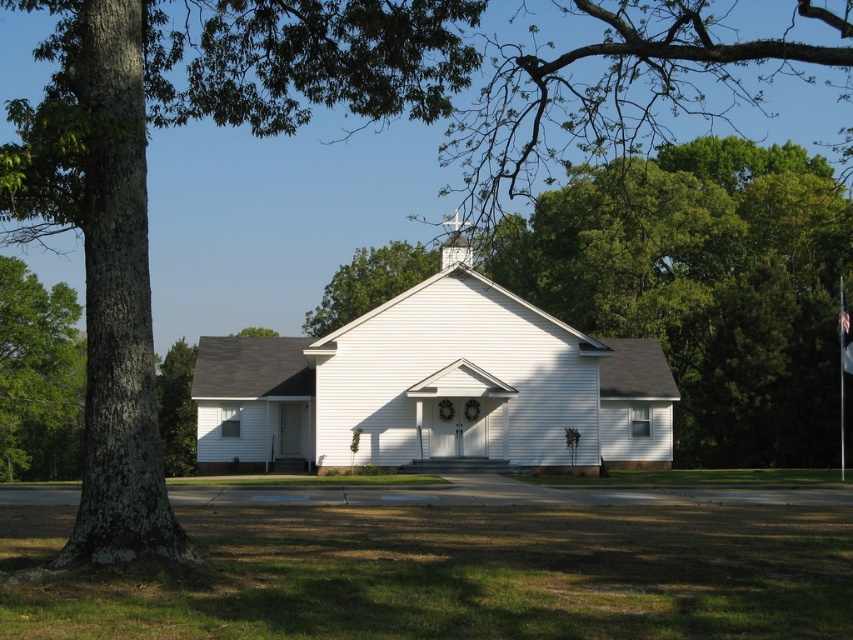
Question: Does green leafy tree at left have a lesser width compared to white wood spire at upper center?

Choices:
 (A) yes
 (B) no

Answer: (B)

Question: Is white wood church at center closer to the viewer compared to white wood spire at upper center?

Choices:
 (A) no
 (B) yes

Answer: (B)

Question: Which object appears closest to the camera in this image?

Choices:
 (A) green leafy tree at center
 (B) white wood spire at upper center
 (C) green leafy tree at left
 (D) green rough bark tree at left

Answer: (D)

Question: Does green leafy tree at left have a larger size compared to white wood spire at upper center?

Choices:
 (A) yes
 (B) no

Answer: (A)

Question: Which of the following is the closest to the observer?

Choices:
 (A) green leafy tree at left
 (B) white wood spire at upper center
 (C) white wood church at center

Answer: (C)

Question: Which object is the farthest from the white wood spire at upper center?

Choices:
 (A) green rough bark tree at left
 (B) green leafy tree at left
 (C) white wood church at center
 (D) green leafy tree at center

Answer: (B)